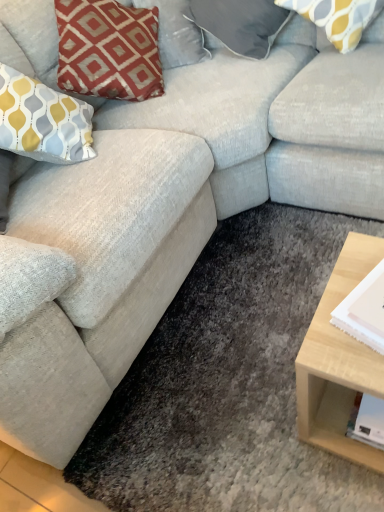
Question: Is satin gray pillow at upper center, which appears as the 2th pillow when viewed from the right, located within yellow and gray patterned pillow at upper right, positioned as the 2th pillow in left-to-right order?

Choices:
 (A) no
 (B) yes

Answer: (A)

Question: Is yellow and gray patterned pillow at upper right, positioned as the 2th pillow in left-to-right order, further to the viewer compared to satin gray pillow at upper center, arranged as the 1th pillow when viewed from the left?

Choices:
 (A) no
 (B) yes

Answer: (A)

Question: Can you confirm if yellow and gray patterned pillow at upper right, positioned as the 2th pillow in left-to-right order, is taller than satin gray pillow at upper center, arranged as the 1th pillow when viewed from the left?

Choices:
 (A) no
 (B) yes

Answer: (A)

Question: Could you tell me if yellow and gray patterned pillow at upper right, positioned as the 2th pillow in left-to-right order, is facing satin gray pillow at upper center, which appears as the 2th pillow when viewed from the right?

Choices:
 (A) no
 (B) yes

Answer: (A)

Question: Is yellow and gray patterned pillow at upper right, which appears as the first pillow when viewed from the right, at the left side of satin gray pillow at upper center, arranged as the 1th pillow when viewed from the left?

Choices:
 (A) no
 (B) yes

Answer: (A)

Question: Considering the relative sizes of yellow and gray patterned pillow at upper right, positioned as the 2th pillow in left-to-right order, and satin gray pillow at upper center, which appears as the 2th pillow when viewed from the right, in the image provided, is yellow and gray patterned pillow at upper right, positioned as the 2th pillow in left-to-right order, wider than satin gray pillow at upper center, which appears as the 2th pillow when viewed from the right,?

Choices:
 (A) yes
 (B) no

Answer: (B)

Question: Does white paper at right lie in front of satin gray pillow at upper center, which appears as the 2th pillow when viewed from the right?

Choices:
 (A) no
 (B) yes

Answer: (B)

Question: Is white paper at right further to camera compared to satin gray pillow at upper center, arranged as the 1th pillow when viewed from the left?

Choices:
 (A) no
 (B) yes

Answer: (A)

Question: Does white paper at right have a greater height compared to satin gray pillow at upper center, arranged as the 1th pillow when viewed from the left?

Choices:
 (A) no
 (B) yes

Answer: (A)

Question: Is white paper at right to the right of satin gray pillow at upper center, which appears as the 2th pillow when viewed from the right, from the viewer's perspective?

Choices:
 (A) yes
 (B) no

Answer: (A)

Question: Are white paper at right and satin gray pillow at upper center, arranged as the 1th pillow when viewed from the left, making contact?

Choices:
 (A) yes
 (B) no

Answer: (B)

Question: Are white paper at right and satin gray pillow at upper center, arranged as the 1th pillow when viewed from the left, far apart?

Choices:
 (A) no
 (B) yes

Answer: (B)

Question: Is satin gray pillow at upper center, arranged as the 1th pillow when viewed from the left, facing away from yellow and gray patterned pillow at upper right, positioned as the 2th pillow in left-to-right order?

Choices:
 (A) yes
 (B) no

Answer: (B)